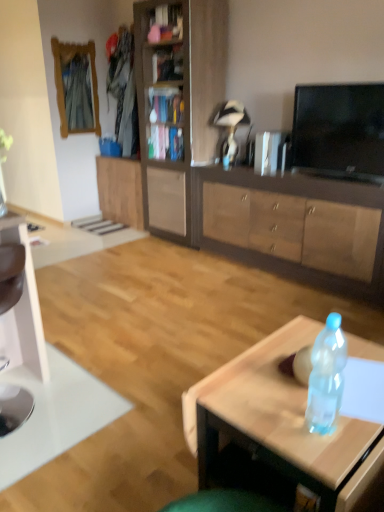
Describe the element at coordinates (289, 226) in the screenshot. The height and width of the screenshot is (512, 384). I see `brown wood cabinet at center, positioned as the first cabinetry in right-to-left order` at that location.

Where is `wooden bookshelf at center`? Image resolution: width=384 pixels, height=512 pixels. wooden bookshelf at center is located at coordinates [165, 105].

The image size is (384, 512). Describe the element at coordinates (165, 105) in the screenshot. I see `wooden bookshelf at center` at that location.

The height and width of the screenshot is (512, 384). What do you see at coordinates (178, 108) in the screenshot?
I see `wooden cabinet at center, which is the 2th cabinetry in right-to-left order` at bounding box center [178, 108].

At what (x,y) coordinates should I click in order to perform the action: click on wooden cabinet at center, marked as the 1th cabinetry in a left-to-right arrangement. Please return your answer as a coordinate pair (x, y). This screenshot has height=512, width=384. Looking at the image, I should click on (120, 190).

Measure the distance between wooden bookshelf at upper center and camera.

wooden bookshelf at upper center and camera are 11.88 feet apart from each other.

This screenshot has width=384, height=512. Find the location of `wooden bookshelf at upper center`. wooden bookshelf at upper center is located at coordinates 166,24.

Locate an element on the screen. white glossy computer desk at left is located at coordinates (21, 293).

Is wooden bookshelf at center bigger or smaller than brown wood cabinet at center, positioned as the first cabinetry in right-to-left order?

Clearly, wooden bookshelf at center is smaller in size than brown wood cabinet at center, positioned as the first cabinetry in right-to-left order.

Is point (173, 88) closer to viewer compared to point (311, 224)?

No, it is not.

From the image's perspective, between wooden bookshelf at center and brown wood cabinet at center, positioned as the 3th cabinetry in left-to-right order, who is located below?

From the image's view, brown wood cabinet at center, positioned as the 3th cabinetry in left-to-right order, is below.

Can we say wooden bookshelf at center lies outside brown wood cabinet at center, positioned as the first cabinetry in right-to-left order?

Yes, wooden bookshelf at center is not within brown wood cabinet at center, positioned as the first cabinetry in right-to-left order.

Consider the image. Is white glossy computer desk at left turned away from flat screen tv at upper right?

No, white glossy computer desk at left is not facing the opposite direction of flat screen tv at upper right.

From the image's perspective, relative to flat screen tv at upper right, is white glossy computer desk at left above or below?

Based on their image positions, white glossy computer desk at left is located beneath flat screen tv at upper right.

Considering the positions of objects white glossy computer desk at left and flat screen tv at upper right in the image provided, who is more to the left, white glossy computer desk at left or flat screen tv at upper right?

Positioned to the left is white glossy computer desk at left.

Consider the image. Between wooden bookshelf at upper center and translucent plastic bottle at center, which one appears on the right side from the viewer's perspective?

translucent plastic bottle at center is more to the right.

Does point (154, 40) lie in front of point (279, 460)?

No, it is behind (279, 460).

Looking at this image, is wooden bookshelf at upper center in contact with translucent plastic bottle at center?

No.

In the scene shown: Which object is further away from the camera taking this photo, wooden bookshelf at upper center or translucent plastic bottle at center?

Positioned behind is wooden bookshelf at upper center.

Is wooden bookshelf at center to the left of white glossy computer desk at left from the viewer's perspective?

No, wooden bookshelf at center is not to the left of white glossy computer desk at left.

Is wooden bookshelf at center smaller than white glossy computer desk at left?

Yes.

Who is taller, wooden bookshelf at center or white glossy computer desk at left?

white glossy computer desk at left.

Based on the photo, which of these two, white glossy computer desk at left or wooden bookshelf at center, is smaller?

wooden bookshelf at center is smaller.

Is white glossy computer desk at left directly adjacent to wooden bookshelf at center?

There is a gap between white glossy computer desk at left and wooden bookshelf at center.

Which is behind, white glossy computer desk at left or wooden bookshelf at center?

wooden bookshelf at center.

From a real-world perspective, is white glossy computer desk at left above or below wooden cabinet at center, placed as the third cabinetry when sorted from right to left?

white glossy computer desk at left is above wooden cabinet at center, placed as the third cabinetry when sorted from right to left.

Is white glossy computer desk at left wider than wooden cabinet at center, placed as the third cabinetry when sorted from right to left?

Correct, the width of white glossy computer desk at left exceeds that of wooden cabinet at center, placed as the third cabinetry when sorted from right to left.

Is white glossy computer desk at left not close to wooden cabinet at center, marked as the 1th cabinetry in a left-to-right arrangement?

Yes, white glossy computer desk at left is far from wooden cabinet at center, marked as the 1th cabinetry in a left-to-right arrangement.

Is white glossy computer desk at left not within wooden cabinet at center, marked as the 1th cabinetry in a left-to-right arrangement?

white glossy computer desk at left is positioned outside wooden cabinet at center, marked as the 1th cabinetry in a left-to-right arrangement.

How different are the orientations of white glossy computer desk at left and wooden frame mirror at upper left in degrees?

The facing directions of white glossy computer desk at left and wooden frame mirror at upper left are 180 degrees apart.

Between point (21, 305) and point (62, 121), which one is positioned in front?

The point (21, 305) is closer.

Are white glossy computer desk at left and wooden frame mirror at upper left making contact?

No, white glossy computer desk at left is not with wooden frame mirror at upper left.

The height and width of the screenshot is (512, 384). I want to click on cabinet lying above the brown wood cabinet at center, positioned as the 3th cabinetry in left-to-right order (from the image's perspective), so click(x=165, y=105).

Where is `computer desk in front of the flat screen tv at upper right`? computer desk in front of the flat screen tv at upper right is located at coordinates (21, 293).

Which object lies further to the anchor point wooden cabinet at center, placed as the third cabinetry when sorted from right to left, brown wood cabinet at center, positioned as the first cabinetry in right-to-left order, or white glossy computer desk at left?

Among the two, white glossy computer desk at left is located further to wooden cabinet at center, placed as the third cabinetry when sorted from right to left.

When comparing their distances from wooden bookshelf at upper center, does translucent plastic bottle at center or flat screen tv at upper right seem closer?

flat screen tv at upper right lies closer to wooden bookshelf at upper center than the other object.

Which object lies nearer to the anchor point flat screen tv at upper right, white glossy computer desk at left or brown wood cabinet at center, positioned as the 3th cabinetry in left-to-right order?

A: brown wood cabinet at center, positioned as the 3th cabinetry in left-to-right order, lies closer to flat screen tv at upper right than the other object.

Considering their positions, is wooden frame mirror at upper left positioned closer to wooden cabinet at center, marked as the 1th cabinetry in a left-to-right arrangement, than white glossy computer desk at left?

wooden frame mirror at upper left is positioned closer to the anchor wooden cabinet at center, marked as the 1th cabinetry in a left-to-right arrangement.

Looking at the image, which one is located further to wooden cabinet at center, which is the 2th cabinetry in right-to-left order, white glossy computer desk at left or metallic silver tv at upper right?

Based on the image, white glossy computer desk at left appears to be further to wooden cabinet at center, which is the 2th cabinetry in right-to-left order.

When comparing their distances from wooden frame mirror at upper left, does wooden bookshelf at upper center or flat screen tv at upper right seem closer?

Based on the image, wooden bookshelf at upper center appears to be nearer to wooden frame mirror at upper left.

From the image, which object appears to be nearer to wooden bookshelf at center, translucent plastic bottle at center or metallic silver tv at upper right?

metallic silver tv at upper right lies closer to wooden bookshelf at center than the other object.

From the image, which object appears to be farther from metallic silver tv at upper right, wooden bookshelf at center or wooden frame mirror at upper left?

Among the two, wooden frame mirror at upper left is located further to metallic silver tv at upper right.

Where is `cabinetry between wooden bookshelf at center and metallic silver tv at upper right`? This screenshot has width=384, height=512. cabinetry between wooden bookshelf at center and metallic silver tv at upper right is located at coordinates click(x=178, y=108).

At what (x,y) coordinates should I click in order to perform the action: click on shelf between translucent plastic bottle at center and wooden frame mirror at upper left along the z-axis. Please return your answer as a coordinate pair (x, y). Looking at the image, I should click on (166, 24).

Locate an element on the screen. Image resolution: width=384 pixels, height=512 pixels. cabinet between brown wood cabinet at center, positioned as the first cabinetry in right-to-left order, and wooden cabinet at center, placed as the third cabinetry when sorted from right to left, from front to back is located at coordinates (165, 105).

The width and height of the screenshot is (384, 512). I want to click on shelf positioned between translucent plastic bottle at center and wooden cabinet at center, placed as the third cabinetry when sorted from right to left, from near to far, so click(x=166, y=24).